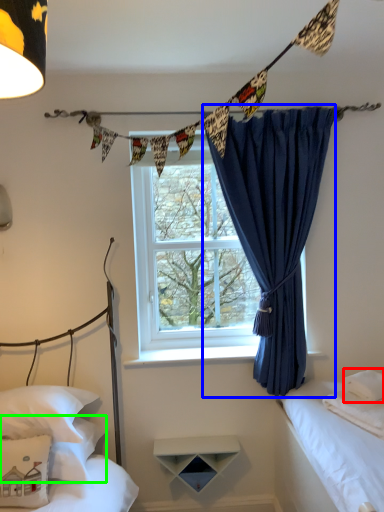
Question: Estimate the real-world distances between objects in this image. Which object is farther from pillow (highlighted by a red box), curtain (highlighted by a blue box) or pillow (highlighted by a green box)?

Choices:
 (A) curtain
 (B) pillow

Answer: (B)